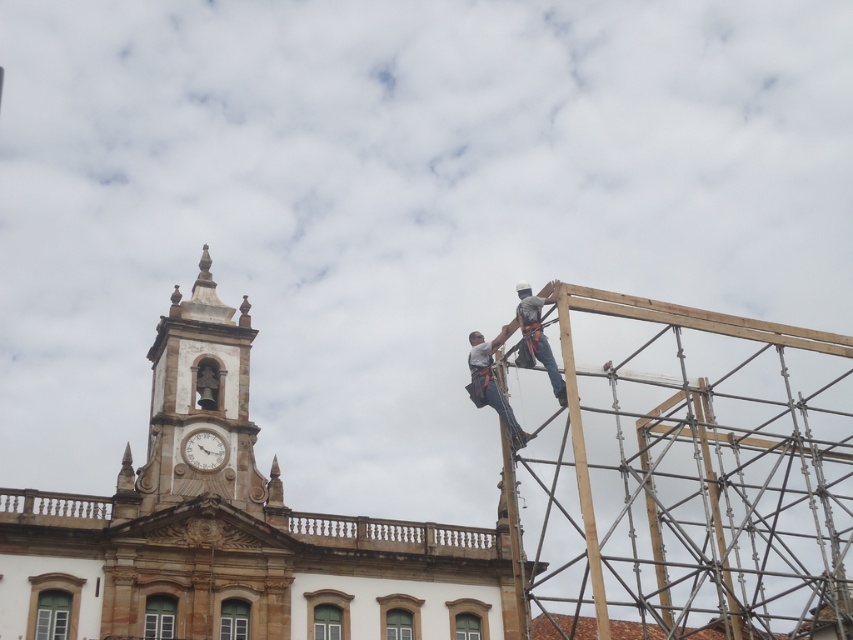
Question: Which object appears farthest from the camera in this image?

Choices:
 (A) gray fabric harness at upper center
 (B) matte gray harness at upper right
 (C) white glossy clock at upper center
 (D) wooden scaffolding at upper right

Answer: (C)

Question: Is gray fabric harness at upper center smaller than white glossy clock at upper center?

Choices:
 (A) no
 (B) yes

Answer: (A)

Question: Does wooden scaffolding at upper right come behind matte gray harness at upper right?

Choices:
 (A) yes
 (B) no

Answer: (B)

Question: Is matte gray harness at upper right to the right of gray fabric harness at upper center from the viewer's perspective?

Choices:
 (A) yes
 (B) no

Answer: (B)

Question: Which object is positioned closest to the gray fabric harness at upper center?

Choices:
 (A) matte gray harness at upper right
 (B) white stone clock tower at upper left
 (C) wooden scaffolding at upper right

Answer: (A)

Question: Among these points, which one is nearest to the camera?

Choices:
 (A) (674, 404)
 (B) (527, 352)
 (C) (512, 323)

Answer: (B)